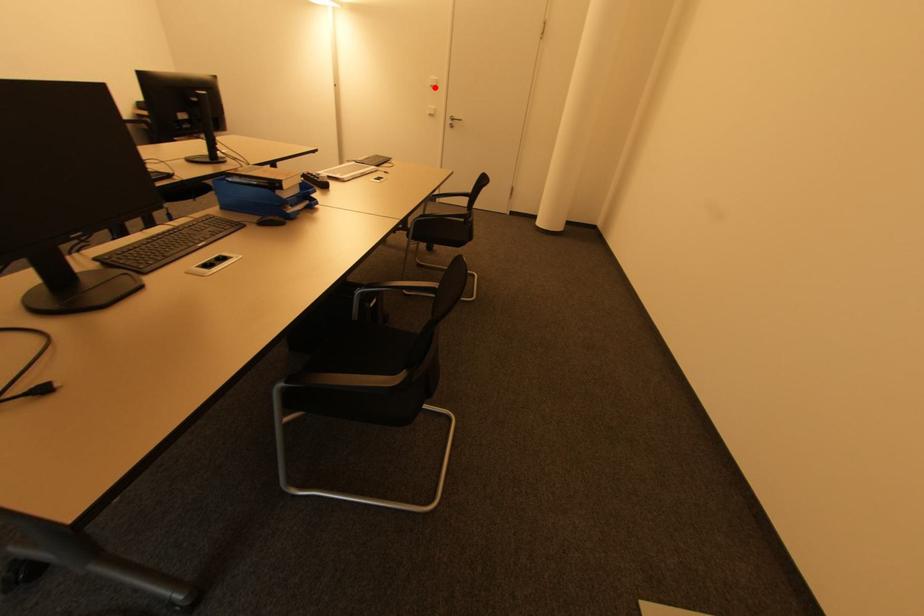
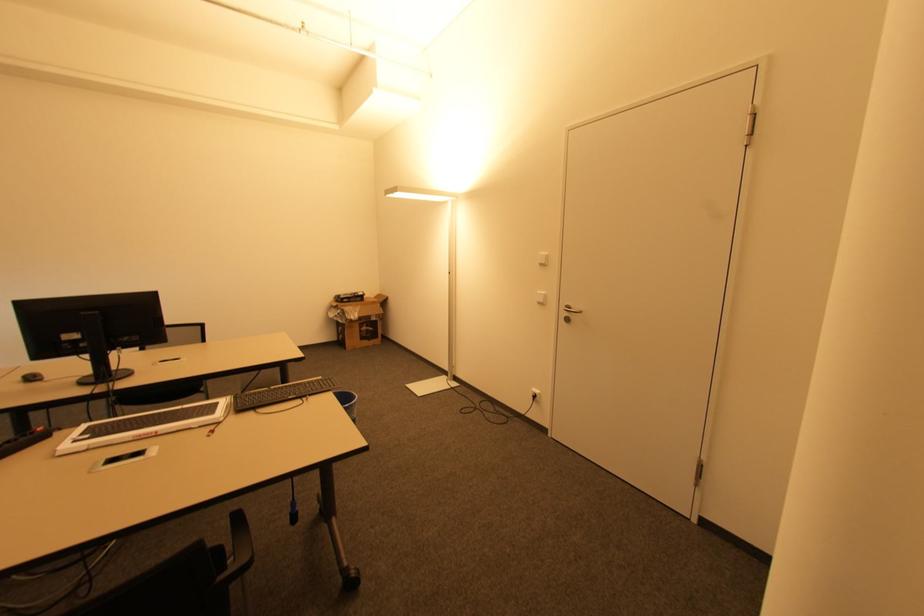
Question: I am providing you with two images of the same scene from different viewpoints. A red point is marked on the first image. At the location where the point appears in image 1, is it still visible in image 2?

Choices:
 (A) Yes
 (B) No

Answer: (A)